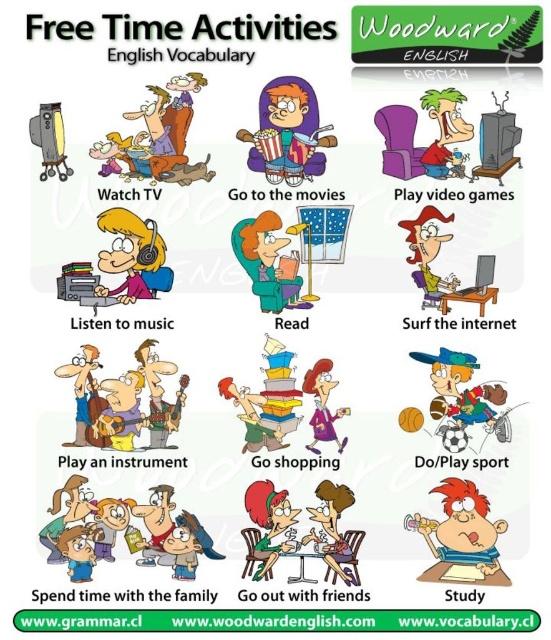
You are a character in the poster and want to choose between the matte orange shirt at center and the matte purple shirt at center. Which one is taller?

The matte orange shirt at center is much taller than the matte purple shirt at center.

Looking at the Play video games activity, you see a character wearing a matte orange shirt at center and holding a reddish hairbrush at center. Which item is positioned to the left?

The matte orange shirt at center is to the left of the reddish hairbrush at center.

Looking at this image, in the image, there are a reddish hairbrush at center and a matte yellow shirt at center. Which object is taller?

The reddish hairbrush at center is taller than the matte yellow shirt at center.